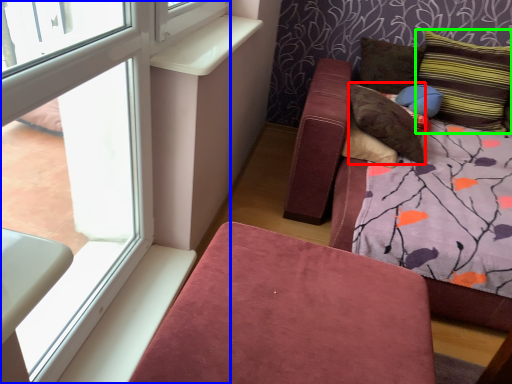
Question: Estimate the real-world distances between objects in this image. Which object is closer to pillow (highlighted by a red box), window (highlighted by a blue box) or pillow (highlighted by a green box)?

Choices:
 (A) window
 (B) pillow

Answer: (B)